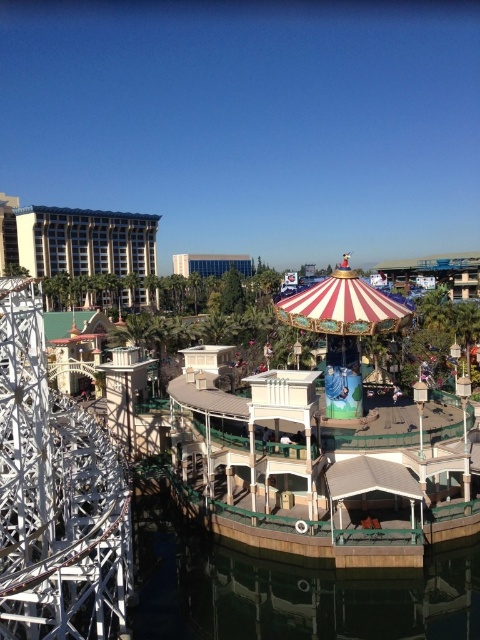
Which is in front, point (266, 621) or point (294, 314)?

Point (266, 621) is more forward.

Does point (417, 612) come closer to viewer compared to point (333, 369)?

Yes, it is in front of point (333, 369).

Image resolution: width=480 pixels, height=640 pixels. What are the coordinates of `brown wood water at lower center` in the screenshot? It's located at (290, 595).